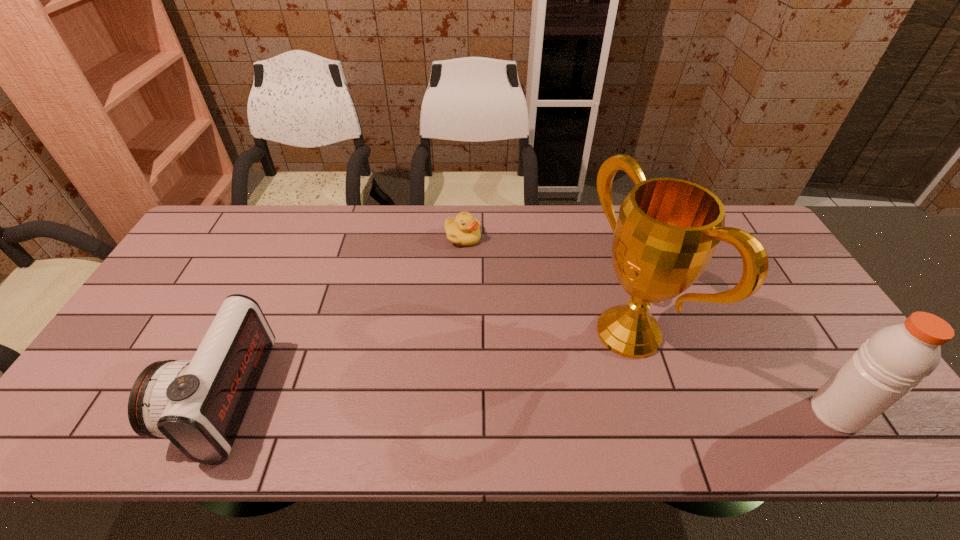
Find the location of `vacant space on the desktop that is between the leftmost object and the second tallest object and is positioned on the front-facing side of the award`. vacant space on the desktop that is between the leftmost object and the second tallest object and is positioned on the front-facing side of the award is located at coordinates (487, 404).

Find the location of a particular element. The height and width of the screenshot is (540, 960). vacant spot on the desktop that is between the camcorder and the shaker and is positioned on the beak of the shortest object is located at coordinates (562, 406).